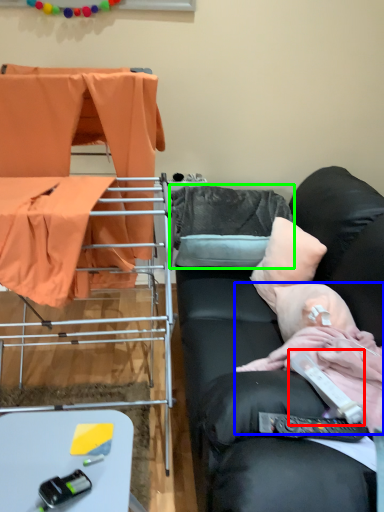
Question: Which object is positioned farthest from equipment (highlighted by a red box)? Select from person (highlighted by a blue box) and pillow (highlighted by a green box).

Choices:
 (A) person
 (B) pillow

Answer: (B)